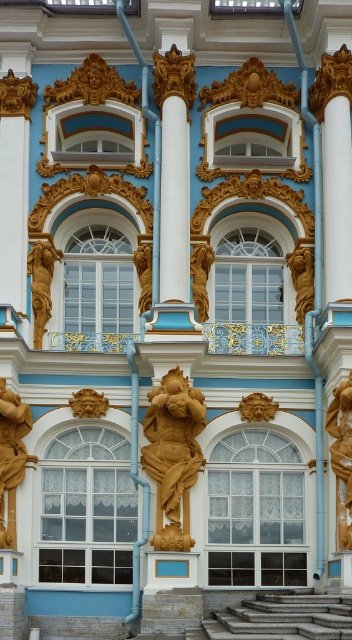
Question: Is gold polished statue at left thinner than gold/gilded statue at center?

Choices:
 (A) no
 (B) yes

Answer: (A)

Question: Can you confirm if gray stone stairs at lower center is positioned above gold/gilded statue at center?

Choices:
 (A) no
 (B) yes

Answer: (A)

Question: Which is nearer to the gold polished statue at center?

Choices:
 (A) gray stone stairs at lower center
 (B) gold polished statue at left
 (C) gold/gilded statue at center
 (D) gold/gilded statue at left

Answer: (A)

Question: Does gray stone stairs at lower center appear on the right side of gold/gilded statue at left?

Choices:
 (A) yes
 (B) no

Answer: (A)

Question: Which object is closer to the camera taking this photo?

Choices:
 (A) gold polished statue at center
 (B) gray stone stairs at lower center

Answer: (B)

Question: Estimate the real-world distances between objects in this image. Which object is closer to the gold/gilded statue at center?

Choices:
 (A) gold/gilded statue at left
 (B) gold polished statue at center
 (C) gray stone stairs at lower center

Answer: (A)